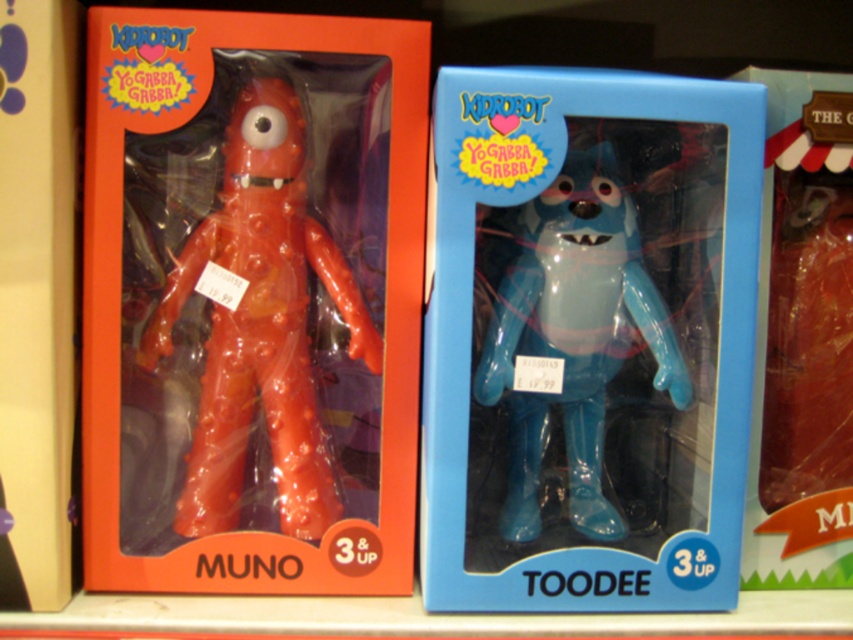
Where is the blue glossy vinyl figure at center located in the image?

The blue glossy vinyl figure at center is located at point (587, 339) in the image.

You are a collector who wants to display both the rubbery red figure at center and the glossy plastic bear at center on a shelf. Based on their positions in the image, which one should you place first to ensure proper arrangement?

The rubbery red figure at center is positioned over the glossy plastic bear at center in the image, so you should place the glossy plastic bear at center first to ensure it is visible underneath.